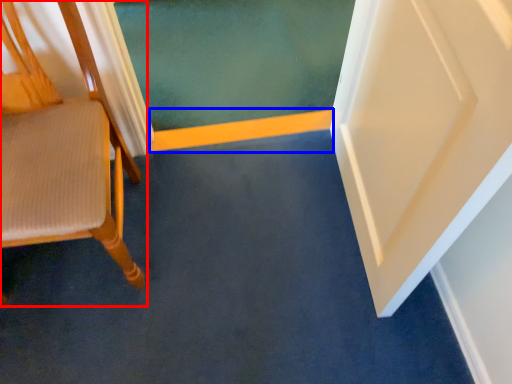
Question: Which object appears farthest to the camera in this image, chair (highlighted by a red box) or strip (highlighted by a blue box)?

Choices:
 (A) chair
 (B) strip

Answer: (B)